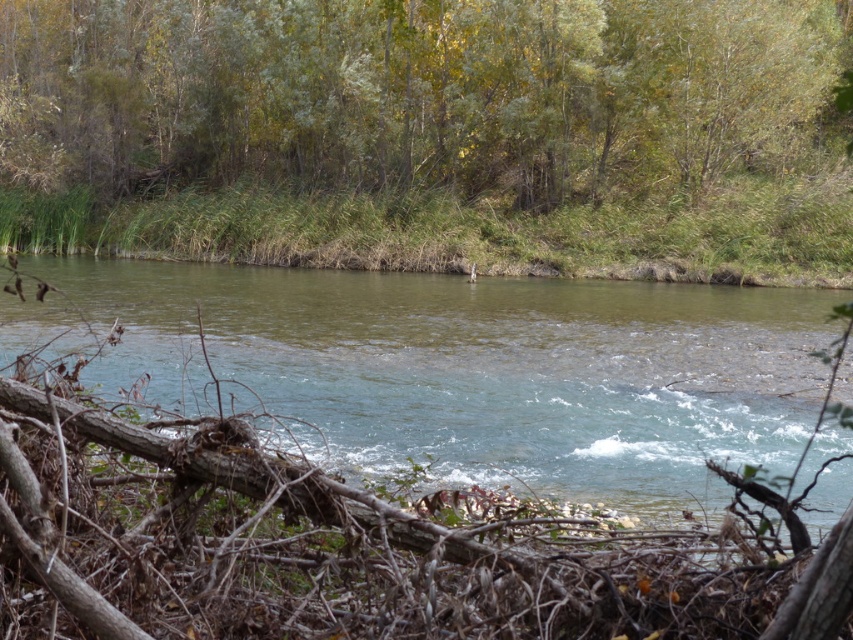
Question: Which point is closer to the camera taking this photo?

Choices:
 (A) (695, 163)
 (B) (682, 442)

Answer: (B)

Question: Which point is farther from the camera taking this photo?

Choices:
 (A) (680, 486)
 (B) (349, 83)

Answer: (B)

Question: Can you confirm if green leafy trees at upper center is positioned to the left of clear water at center?

Choices:
 (A) yes
 (B) no

Answer: (A)

Question: Which point is closer to the camera?

Choices:
 (A) clear water at center
 (B) green leafy trees at upper center

Answer: (A)

Question: Can you confirm if green leafy trees at upper center is positioned to the right of clear water at center?

Choices:
 (A) yes
 (B) no

Answer: (B)

Question: Is green leafy trees at upper center above clear water at center?

Choices:
 (A) no
 (B) yes

Answer: (B)